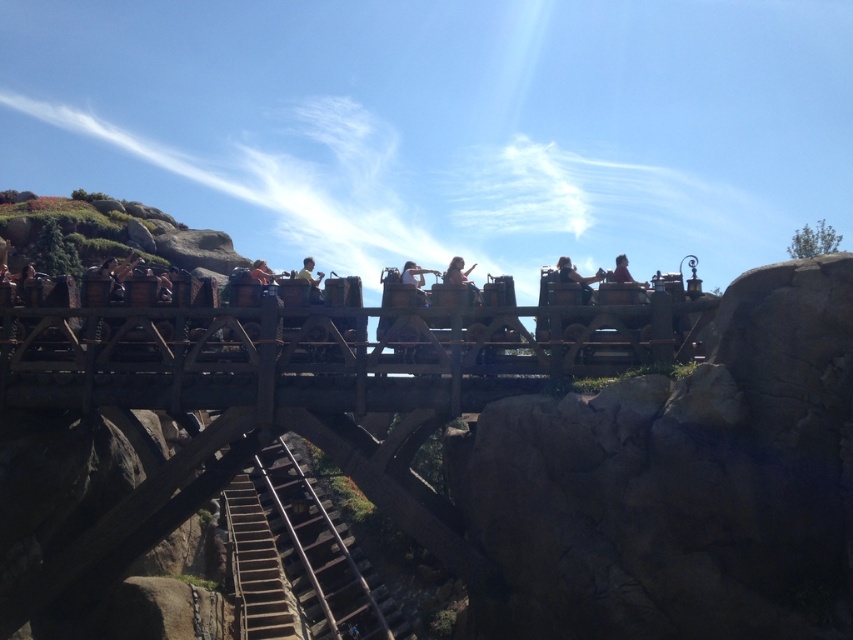
Which is below, wooden stairs at center or light brown wooden roller coaster car at center?

Positioned lower is wooden stairs at center.

Is wooden stairs at center above light brown wooden roller coaster car at center?

No.

Locate an element on the screen. Image resolution: width=853 pixels, height=640 pixels. wooden stairs at center is located at coordinates (257, 570).

Find the location of `wooden stairs at center`. wooden stairs at center is located at coordinates (257, 570).

Does wooden at center have a greater height compared to matte yellow shirt at center?

Correct, wooden at center is much taller as matte yellow shirt at center.

Is point (341, 598) positioned before point (317, 276)?

No.

Where is `wooden at center`? wooden at center is located at coordinates (314, 552).

Who is lower down, wooden at center or wooden stairs at center?

Positioned lower is wooden stairs at center.

Looking at this image, does wooden at center have a lesser height compared to wooden stairs at center?

No.

Where is `wooden at center`? The height and width of the screenshot is (640, 853). wooden at center is located at coordinates (314, 552).

At what (x,y) coordinates should I click in order to perform the action: click on wooden at center. Please return your answer as a coordinate pair (x, y). This screenshot has height=640, width=853. Looking at the image, I should click on (314, 552).